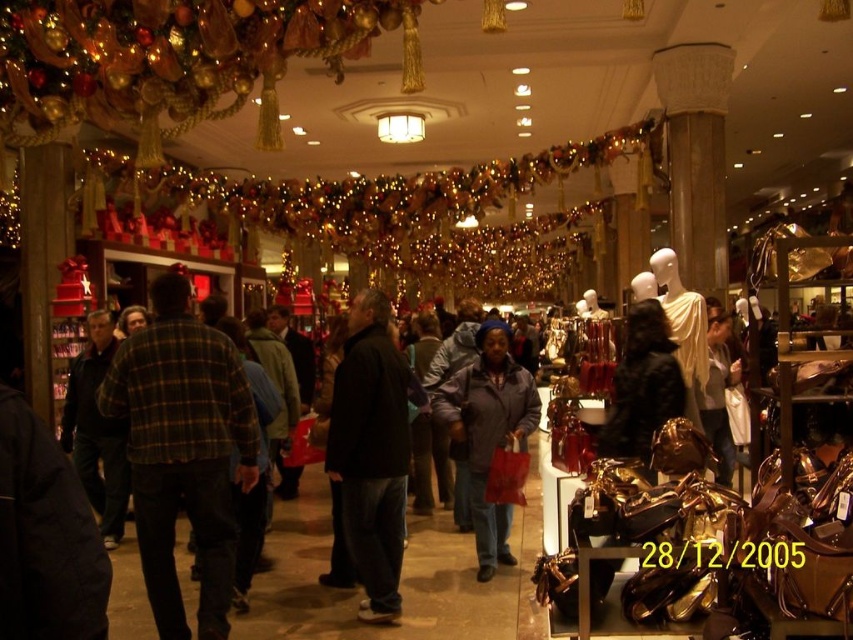
Question: Which of these objects is positioned farthest from the dark gray matte jacket at center?

Choices:
 (A) black matte jacket at center
 (B) plaid flannel shirt at center

Answer: (B)

Question: Can you confirm if black matte jacket at center is positioned above dark gray matte jacket at center?

Choices:
 (A) yes
 (B) no

Answer: (A)

Question: Which point appears closest to the camera in this image?

Choices:
 (A) (198, 586)
 (B) (372, 387)
 (C) (479, 408)

Answer: (B)

Question: Considering the real-world distances, which object is closest to the black matte jacket at center?

Choices:
 (A) plaid flannel shirt at center
 (B) dark gray matte jacket at center

Answer: (B)

Question: Observing the image, what is the correct spatial positioning of plaid flannel shirt at center in reference to black matte jacket at center?

Choices:
 (A) above
 (B) below

Answer: (A)

Question: Does plaid flannel shirt at center appear on the right side of dark gray matte jacket at center?

Choices:
 (A) no
 (B) yes

Answer: (A)